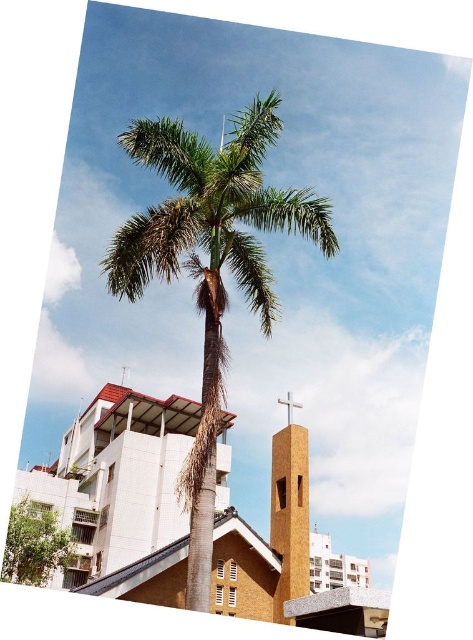
Between point (304, 572) and point (291, 417), which one is positioned behind?

The point (291, 417) is more distant.

From the picture: Who is shorter, yellow textured bell tower at center or metallic cross at center?

Standing shorter between the two is metallic cross at center.

Which is in front, point (298, 595) or point (289, 403)?

Point (298, 595) is in front.

This screenshot has height=640, width=473. Find the location of `yellow textured bell tower at center`. yellow textured bell tower at center is located at coordinates (289, 509).

Between point (216, 605) and point (296, 406), which one is positioned behind?

Point (296, 406)

Which is below, brown textured church steeple at center or metallic cross at center?

brown textured church steeple at center is lower down.

Does point (140, 513) lie behind point (299, 406)?

That is True.

You are a GUI agent. You are given a task and a screenshot of the screen. Output one action in this format:
    pyautogui.click(x=<x>, y=<y>)
    Task: Click on the brown textured church steeple at center
    This screenshot has height=640, width=473.
    Given the screenshot: What is the action you would take?
    pyautogui.click(x=122, y=496)

Does yellow textured bell tower at center have a greater height compared to green leafy tree at lower left?

Yes, yellow textured bell tower at center is taller than green leafy tree at lower left.

Does yellow textured bell tower at center have a lesser width compared to green leafy tree at lower left?

Yes, yellow textured bell tower at center is thinner than green leafy tree at lower left.

You are a GUI agent. You are given a task and a screenshot of the screen. Output one action in this format:
    pyautogui.click(x=<x>, y=<y>)
    Task: Click on the yellow textured bell tower at center
    
    Given the screenshot: What is the action you would take?
    pyautogui.click(x=289, y=509)